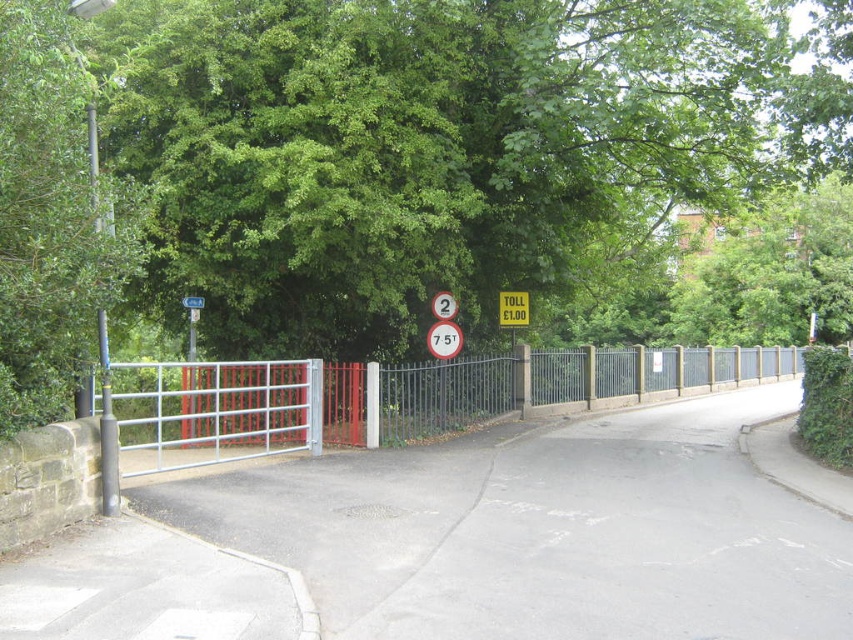
You are driving a car and see the yellow matte toll sign at center and the red plastic sign at center ahead. According to the road layout, which sign is located to the right side of the other?

A: The yellow matte toll sign at center is positioned on the right side of the red plastic sign at center.